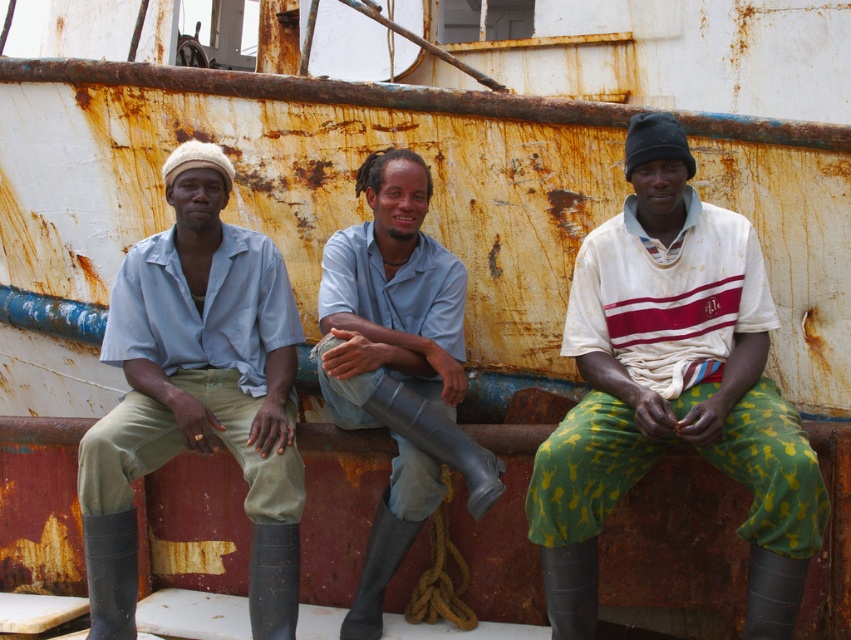
Consider the image. Which is above, white striped shirt at center or gray rubber boots at center?

white striped shirt at center is above.

Is point (634, 252) farther from viewer compared to point (446, 364)?

That is False.

From the picture: Measure the distance between point (701, 340) and camera.

Point (701, 340) and camera are 6.20 meters apart.

Find the location of a particular element. This screenshot has width=851, height=640. white striped shirt at center is located at coordinates (672, 388).

The width and height of the screenshot is (851, 640). What do you see at coordinates (672, 388) in the screenshot?
I see `white striped shirt at center` at bounding box center [672, 388].

Does white striped shirt at center appear over matte blue shirt at center?

Yes.

The height and width of the screenshot is (640, 851). I want to click on white striped shirt at center, so click(x=672, y=388).

Is matte blue shirt at center positioned before gray rubber boots at center?

Yes, it is.

Image resolution: width=851 pixels, height=640 pixels. Describe the element at coordinates (197, 392) in the screenshot. I see `matte blue shirt at center` at that location.

Which is behind, point (213, 349) or point (418, 387)?

Point (213, 349)

What are the coordinates of `matte blue shirt at center` in the screenshot? It's located at click(197, 392).